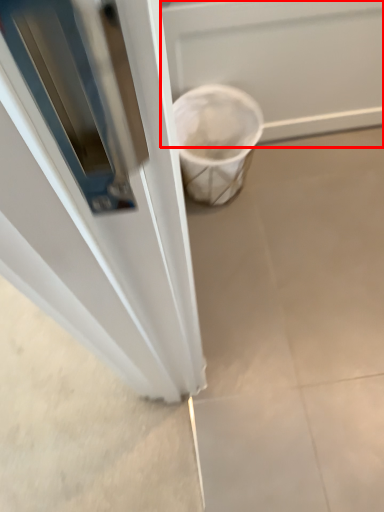
Question: Where is screen door (annotated by the red box) located in relation to concrete in the image?

Choices:
 (A) right
 (B) left

Answer: (A)